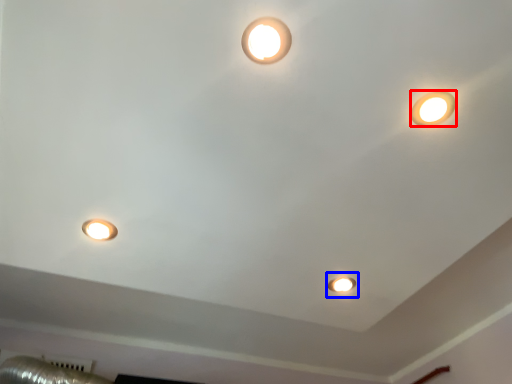
Question: Which object appears closest to the camera in this image, lamp (highlighted by a red box) or stage light (highlighted by a blue box)?

Choices:
 (A) lamp
 (B) stage light

Answer: (A)